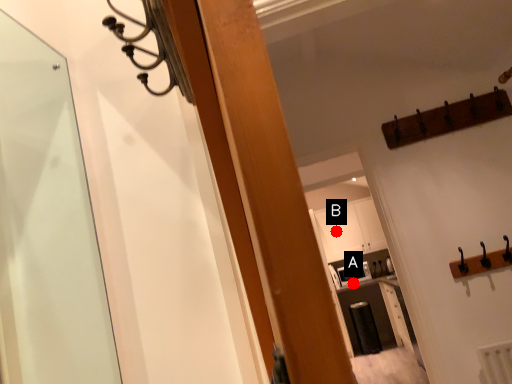
Question: Two points are circled on the image, labeled by A and B beside each circle. Which of the following is the farthest from the observer?

Choices:
 (A) A is further
 (B) B is further

Answer: (B)